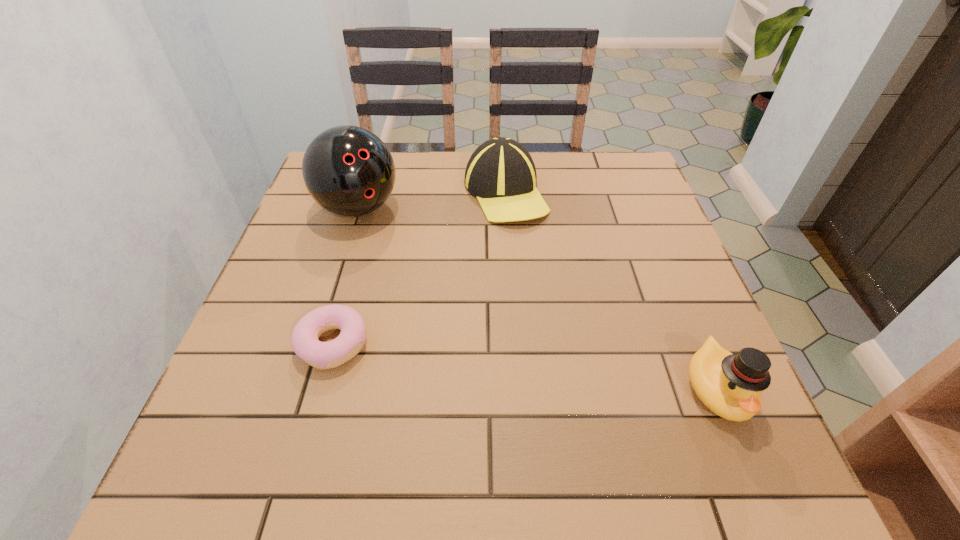
In order to click on vacant space on the desktop that is between the doughnut and the duck and is positioned with the brim of the second object from right to left facing forward in this screenshot , I will do `click(538, 368)`.

Find the location of a particular element. free spot on the desktop that is between the doughnut and the rightmost object and is positioned on the surface of the tallest object near the finger holes is located at coordinates (490, 362).